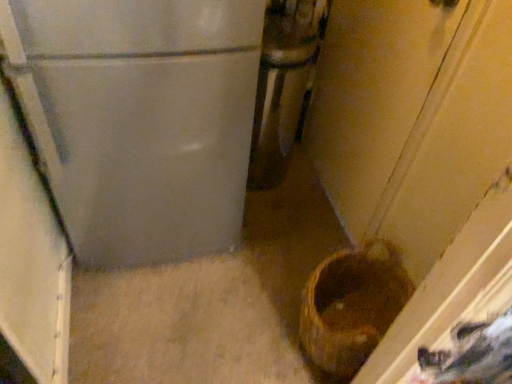
Describe the element at coordinates (283, 84) in the screenshot. I see `metallic silver refrigerator at center` at that location.

Locate an element on the screen. The width and height of the screenshot is (512, 384). metallic silver refrigerator at center is located at coordinates (283, 84).

The height and width of the screenshot is (384, 512). What do you see at coordinates (352, 305) in the screenshot? I see `brown woven basket at lower right` at bounding box center [352, 305].

The image size is (512, 384). Find the location of `brown woven basket at lower right`. brown woven basket at lower right is located at coordinates [x=352, y=305].

What are the coordinates of `metallic silver refrigerator at center` in the screenshot? It's located at (283, 84).

Which is more to the right, metallic silver refrigerator at center or brown woven basket at lower right?

brown woven basket at lower right.

Considering their positions, is metallic silver refrigerator at center located in front of or behind brown woven basket at lower right?

Visually, metallic silver refrigerator at center is located behind brown woven basket at lower right.

Between point (262, 175) and point (355, 366), which one is positioned in front?

Point (355, 366)

From the image's perspective, is metallic silver refrigerator at center on top of brown woven basket at lower right?

Yes, from the image's perspective, metallic silver refrigerator at center is above brown woven basket at lower right.

From a real-world perspective, is metallic silver refrigerator at center located beneath brown woven basket at lower right?

Actually, metallic silver refrigerator at center is physically above brown woven basket at lower right in the real world.

Does metallic silver refrigerator at center have a lesser width compared to brown woven basket at lower right?

Incorrect, the width of metallic silver refrigerator at center is not less than that of brown woven basket at lower right.

Does metallic silver refrigerator at center have a greater height compared to brown woven basket at lower right?

Indeed, metallic silver refrigerator at center has a greater height compared to brown woven basket at lower right.

Can you confirm if metallic silver refrigerator at center is smaller than brown woven basket at lower right?

Actually, metallic silver refrigerator at center might be larger than brown woven basket at lower right.

From the picture: Would you say brown woven basket at lower right is part of metallic silver refrigerator at center's contents?

That's incorrect, brown woven basket at lower right is not inside metallic silver refrigerator at center.

Is metallic silver refrigerator at center next to brown woven basket at lower right?

No, metallic silver refrigerator at center is not touching brown woven basket at lower right.

Is metallic silver refrigerator at center oriented towards brown woven basket at lower right?

Yes, metallic silver refrigerator at center is turned towards brown woven basket at lower right.

What's the angular difference between metallic silver refrigerator at center and brown woven basket at lower right's facing directions?

The angular difference between metallic silver refrigerator at center and brown woven basket at lower right is 90.2 degrees.

Image resolution: width=512 pixels, height=384 pixels. In the image, there is a metallic silver refrigerator at center. Identify the location of basket container below it (from the image's perspective). (352, 305).

Which object is positioned more to the left, brown woven basket at lower right or metallic silver refrigerator at center?

From the viewer's perspective, metallic silver refrigerator at center appears more on the left side.

Which object is more forward, brown woven basket at lower right or metallic silver refrigerator at center?

brown woven basket at lower right is in front.

Which is in front, point (318, 335) or point (296, 6)?

The point (318, 335) is closer.

From the image's perspective, between brown woven basket at lower right and metallic silver refrigerator at center, who is located below?

brown woven basket at lower right.

From a real-world perspective, is brown woven basket at lower right physically located above or below metallic silver refrigerator at center?

brown woven basket at lower right is below metallic silver refrigerator at center.

Between brown woven basket at lower right and metallic silver refrigerator at center, which one has larger width?

Answer: metallic silver refrigerator at center is wider.

Who is shorter, brown woven basket at lower right or metallic silver refrigerator at center?

brown woven basket at lower right is shorter.

Looking at the image, does brown woven basket at lower right seem bigger or smaller compared to metallic silver refrigerator at center?

In the image, brown woven basket at lower right appears to be smaller than metallic silver refrigerator at center.

Which is correct: brown woven basket at lower right is inside metallic silver refrigerator at center, or outside of it?

brown woven basket at lower right is spatially situated outside metallic silver refrigerator at center.

Would you say brown woven basket at lower right is a long distance from metallic silver refrigerator at center?

Result: No, brown woven basket at lower right is not far away from metallic silver refrigerator at center.

Is brown woven basket at lower right turned away from metallic silver refrigerator at center?

brown woven basket at lower right does not have its back to metallic silver refrigerator at center.

Find the location of a particular element. This screenshot has width=512, height=384. basket container that is on the right side of metallic silver refrigerator at center is located at coordinates (352, 305).

Where is `appliance lying above the brown woven basket at lower right (from the image's perspective)`? appliance lying above the brown woven basket at lower right (from the image's perspective) is located at coordinates (283, 84).

At what (x,y) coordinates should I click in order to perform the action: click on appliance to the left of brown woven basket at lower right. Please return your answer as a coordinate pair (x, y). The image size is (512, 384). Looking at the image, I should click on (283, 84).